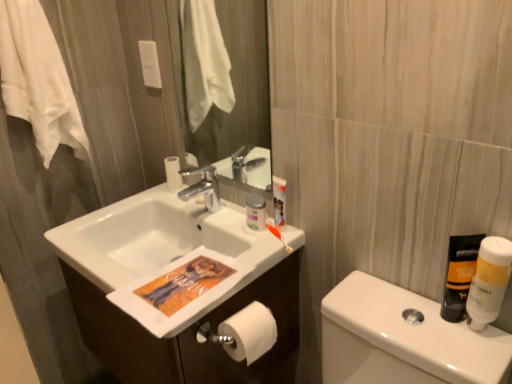
Question: Is white glossy sink at center with white glossy cabinet at center?

Choices:
 (A) no
 (B) yes

Answer: (A)

Question: Does white glossy sink at center appear on the left side of white glossy cabinet at center?

Choices:
 (A) no
 (B) yes

Answer: (B)

Question: From a real-world perspective, is white glossy sink at center below white glossy cabinet at center?

Choices:
 (A) no
 (B) yes

Answer: (A)

Question: Can you confirm if white glossy sink at center is smaller than white glossy cabinet at center?

Choices:
 (A) yes
 (B) no

Answer: (A)

Question: Considering the relative sizes of white glossy sink at center and white glossy cabinet at center in the image provided, is white glossy sink at center bigger than white glossy cabinet at center?

Choices:
 (A) yes
 (B) no

Answer: (B)

Question: Does white glossy sink at center come behind white glossy cabinet at center?

Choices:
 (A) yes
 (B) no

Answer: (B)

Question: From the image's perspective, is matte glass mirror at upper center beneath white matte bottle at right, arranged as the 2th mouthwash when viewed from the left?

Choices:
 (A) yes
 (B) no

Answer: (B)

Question: Can you confirm if matte glass mirror at upper center is positioned to the left of white matte bottle at right, which is counted as the first mouthwash, starting from the right?

Choices:
 (A) no
 (B) yes

Answer: (B)

Question: From a real-world perspective, does matte glass mirror at upper center sit lower than white matte bottle at right, which is counted as the first mouthwash, starting from the right?

Choices:
 (A) yes
 (B) no

Answer: (B)

Question: Considering the relative sizes of matte glass mirror at upper center and white matte bottle at right, arranged as the 2th mouthwash when viewed from the left, in the image provided, is matte glass mirror at upper center thinner than white matte bottle at right, arranged as the 2th mouthwash when viewed from the left,?

Choices:
 (A) no
 (B) yes

Answer: (B)

Question: From the image's perspective, is matte glass mirror at upper center on white matte bottle at right, arranged as the 2th mouthwash when viewed from the left?

Choices:
 (A) yes
 (B) no

Answer: (A)

Question: Is matte glass mirror at upper center positioned beyond the bounds of white matte bottle at right, arranged as the 2th mouthwash when viewed from the left?

Choices:
 (A) yes
 (B) no

Answer: (A)

Question: Does white cotton towel at upper left have a smaller size compared to white glossy cabinet at center?

Choices:
 (A) yes
 (B) no

Answer: (A)